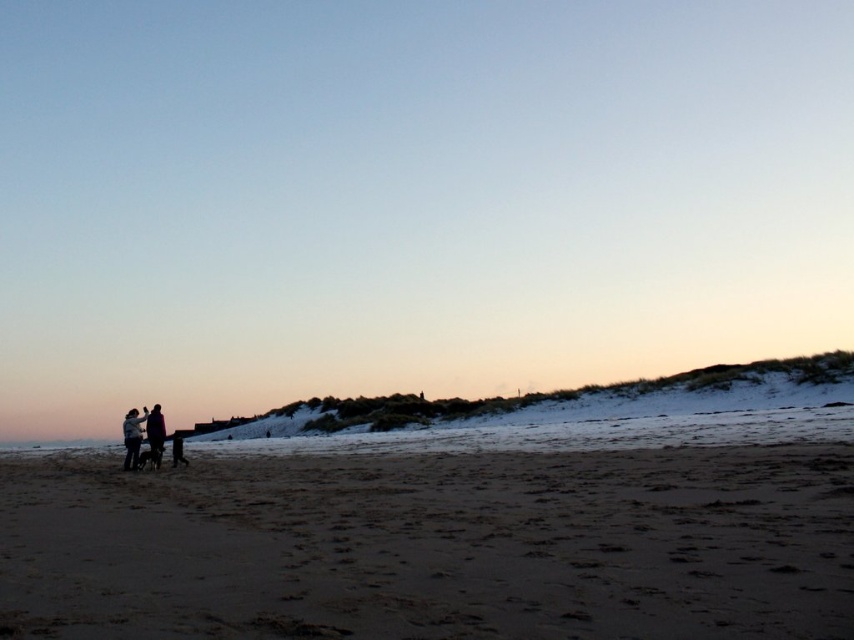
Question: Which of these objects is positioned closest to the light gray fabric jacket at lower left?

Choices:
 (A) silhouette clothing at lower left
 (B) brown sandy beach at lower left

Answer: (A)

Question: Which is nearer to the silhouette clothing at lower left?

Choices:
 (A) dark blue jacket at lower left
 (B) light gray fabric jacket at lower left
 (C) brown sandy beach at lower left

Answer: (B)

Question: Can you confirm if light gray fabric jacket at lower left is positioned above dark blue jacket at lower left?

Choices:
 (A) no
 (B) yes

Answer: (A)

Question: Is silhouette clothing at lower left positioned behind light gray fabric jacket at lower left?

Choices:
 (A) yes
 (B) no

Answer: (B)

Question: Which point is closer to the camera?

Choices:
 (A) light gray fabric jacket at lower left
 (B) silhouette clothing at lower left

Answer: (B)

Question: Does silhouette clothing at lower left appear under light gray fabric jacket at lower left?

Choices:
 (A) yes
 (B) no

Answer: (B)